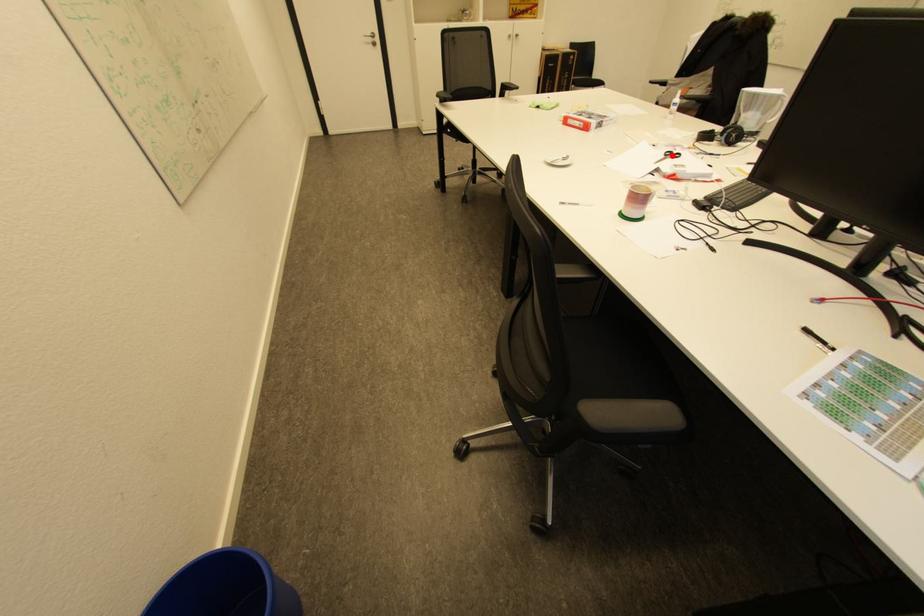
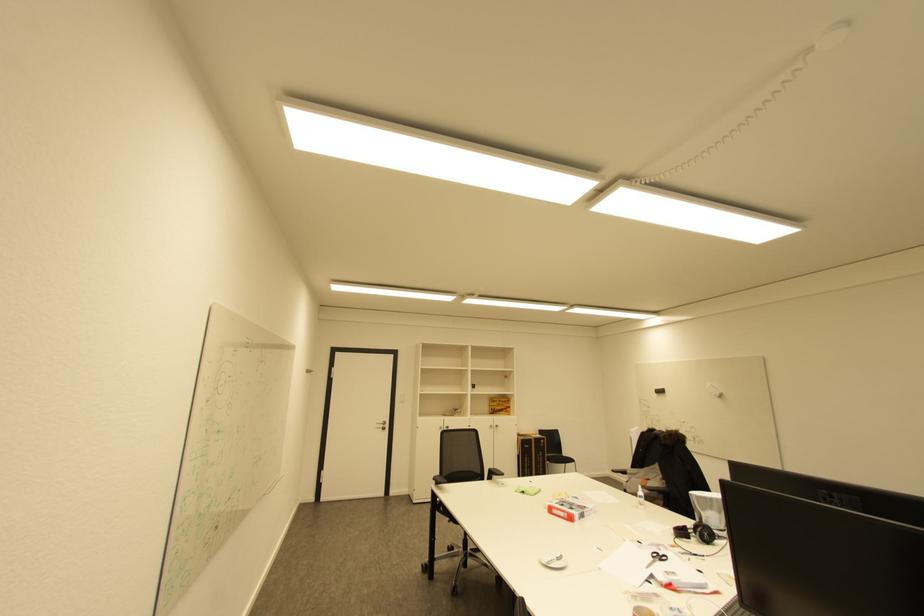
Where in the second image is the point corresponding to the highlighted location from the first image?

(659, 557)